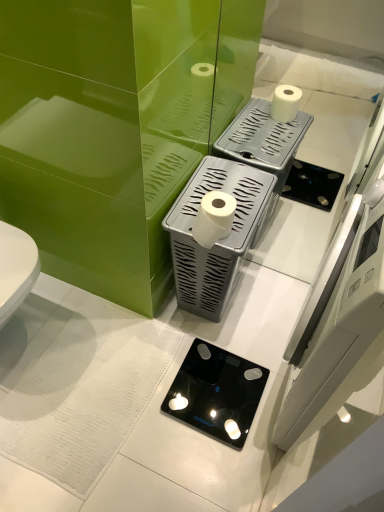
Question: Would you say white plastic toilet paper holder at center, the first appliance viewed from the top, is inside or outside black glass scale at center, the second appliance when ordered from top to bottom?

Choices:
 (A) inside
 (B) outside

Answer: (B)

Question: From the image's perspective, is white plastic toilet paper holder at center, the first appliance viewed from the top, located above or below black glass scale at center, the second appliance when ordered from top to bottom?

Choices:
 (A) above
 (B) below

Answer: (A)

Question: Estimate the real-world distances between objects in this image. Which object is closer to the white plastic toilet paper holder at center, the first appliance viewed from the top?

Choices:
 (A) black glass scale at center, marked as the 1th appliance in a bottom-to-top arrangement
 (B) white matte toilet paper at center

Answer: (B)

Question: Which of these objects is positioned closest to the black glass scale at center, marked as the 1th appliance in a bottom-to-top arrangement?

Choices:
 (A) white matte toilet paper at center
 (B) white plastic toilet paper holder at center, which is counted as the 2th appliance, starting from the bottom

Answer: (B)